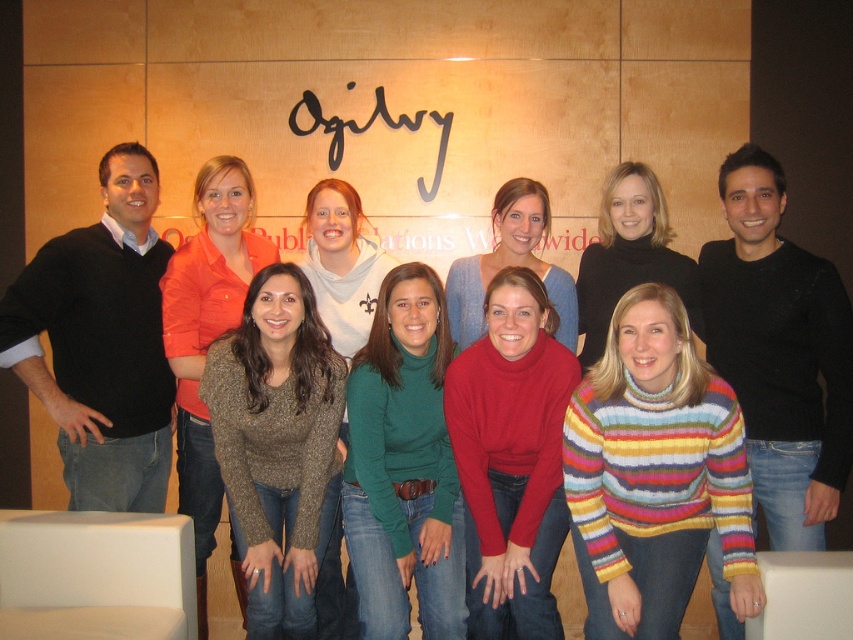
Which is more to the left, matte red turtleneck sweater at center or striped sweater at center?

From the viewer's perspective, matte red turtleneck sweater at center appears more on the left side.

Measure the distance between matte red turtleneck sweater at center and camera.

matte red turtleneck sweater at center and camera are 2.56 meters apart from each other.

Locate an element on the screen. The image size is (853, 640). matte red turtleneck sweater at center is located at coordinates (511, 458).

Is point (602, 424) positioned before point (430, 186)?

Yes, point (602, 424) is in front of point (430, 186).

Does multicolored knitted sweater at center come behind black metal sign at upper center?

No, multicolored knitted sweater at center is closer to the viewer.

Is point (712, 497) positioned before point (390, 124)?

Yes, point (712, 497) is closer to viewer.

This screenshot has width=853, height=640. Find the location of `multicolored knitted sweater at center`. multicolored knitted sweater at center is located at coordinates (653, 472).

The width and height of the screenshot is (853, 640). Describe the element at coordinates (102, 342) in the screenshot. I see `black sweater at left` at that location.

In the scene shown: Is black sweater at left taller than striped sweater at center?

Indeed, black sweater at left has a greater height compared to striped sweater at center.

Between point (96, 445) and point (645, 282), which one is positioned in front?

Positioned in front is point (96, 445).

At what (x,y) coordinates should I click in order to perform the action: click on black sweater at left. Please return your answer as a coordinate pair (x, y). Looking at the image, I should click on (102, 342).